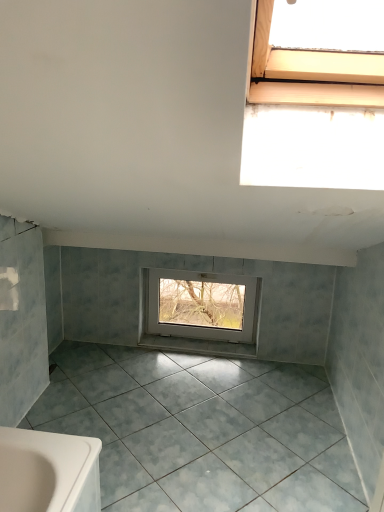
Question: Does white plastic window at center have a greater width compared to white glossy tile at center?

Choices:
 (A) yes
 (B) no

Answer: (B)

Question: Does white plastic window at center have a lesser height compared to white glossy tile at center?

Choices:
 (A) yes
 (B) no

Answer: (B)

Question: Is white plastic window at center bigger than white glossy tile at center?

Choices:
 (A) yes
 (B) no

Answer: (A)

Question: Is white plastic window at center surrounding white glossy tile at center?

Choices:
 (A) no
 (B) yes

Answer: (A)

Question: From a real-world perspective, is white plastic window at center below white glossy tile at center?

Choices:
 (A) yes
 (B) no

Answer: (B)

Question: Can you confirm if white plastic window at center is smaller than white glossy tile at center?

Choices:
 (A) no
 (B) yes

Answer: (A)

Question: From the image's perspective, is gray matte tile at center on white glossy tile at center?

Choices:
 (A) no
 (B) yes

Answer: (A)

Question: Can you confirm if gray matte tile at center is smaller than white glossy tile at center?

Choices:
 (A) no
 (B) yes

Answer: (A)

Question: Considering the relative sizes of gray matte tile at center and white glossy tile at center in the image provided, is gray matte tile at center wider than white glossy tile at center?

Choices:
 (A) no
 (B) yes

Answer: (B)

Question: Can you confirm if gray matte tile at center is positioned to the right of white glossy tile at center?

Choices:
 (A) no
 (B) yes

Answer: (A)

Question: Is gray matte tile at center outside white glossy tile at center?

Choices:
 (A) yes
 (B) no

Answer: (A)

Question: Does gray matte tile at center appear on the left side of white glossy tile at center?

Choices:
 (A) yes
 (B) no

Answer: (A)

Question: Is white glossy tile at center taller than white plastic window at center?

Choices:
 (A) yes
 (B) no

Answer: (B)